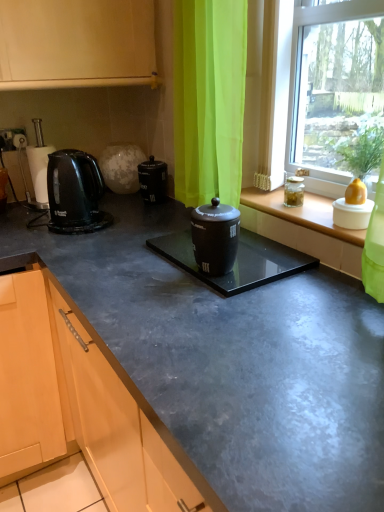
Where is `vacant area on top of matte black coffee canister at center (from a real-world perspective)`? The width and height of the screenshot is (384, 512). vacant area on top of matte black coffee canister at center (from a real-world perspective) is located at coordinates (100, 211).